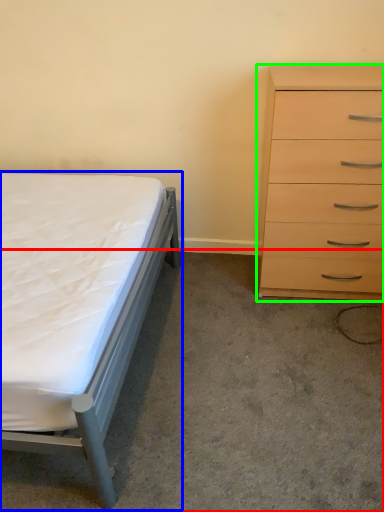
Question: Considering the real-world distances, which object is closest to concrete (highlighted by a red box)? bed (highlighted by a blue box) or chest of drawers (highlighted by a green box).

Choices:
 (A) bed
 (B) chest of drawers

Answer: (A)